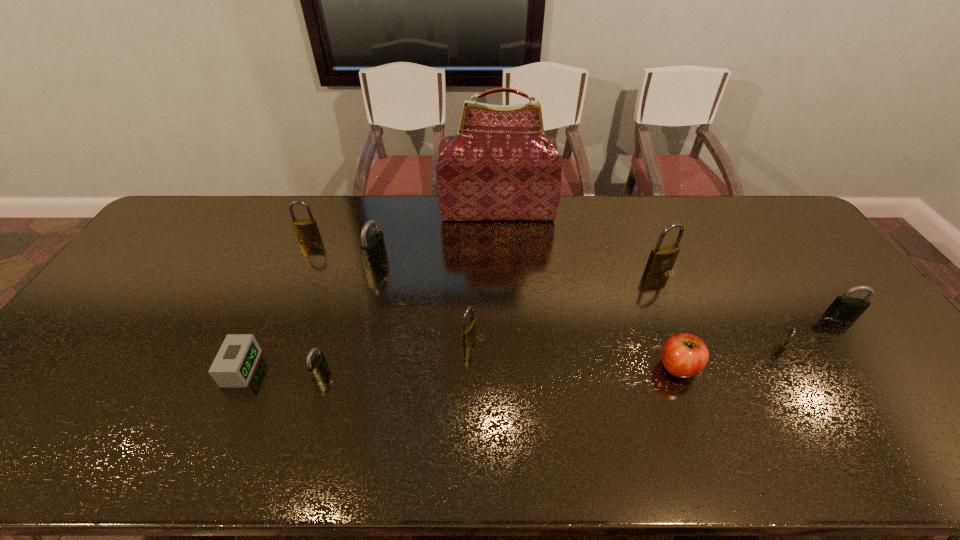
I want to click on object present at the right edge, so click(844, 307).

I want to click on vacant space at the far edge of the desktop, so click(726, 221).

What are the coordinates of `vacant space at the near edge` in the screenshot? It's located at (177, 441).

This screenshot has height=540, width=960. I want to click on blank space at the left edge of the desktop, so click(98, 354).

Image resolution: width=960 pixels, height=540 pixels. Identify the location of vacant space at the right edge of the desktop. (902, 365).

At what (x,y) coordinates should I click in order to perform the action: click on vacant space in between the shortest object and the third brass padlock from left to right. Please return your answer as a coordinate pair (x, y). Image resolution: width=960 pixels, height=540 pixels. Looking at the image, I should click on (450, 319).

Find the location of a particular element. free spot between the leftmost black padlock and the farthest object is located at coordinates (409, 292).

You are a GUI agent. You are given a task and a screenshot of the screen. Output one action in this format:
    pyautogui.click(x=<x>, y=<y>)
    Task: Click on the free point between the nearest padlock and the fourth padlock from right to left
    The image size is (960, 540).
    Given the screenshot: What is the action you would take?
    pyautogui.click(x=395, y=355)

At what (x,y) coordinates should I click in order to perform the action: click on vacant area between the sixth nearest object and the ninth shortest object. Please return your answer as a coordinate pair (x, y). Image resolution: width=960 pixels, height=540 pixels. Looking at the image, I should click on (750, 293).

Identify the location of free space between the second black padlock from right to left and the biggest brass padlock. (517, 265).